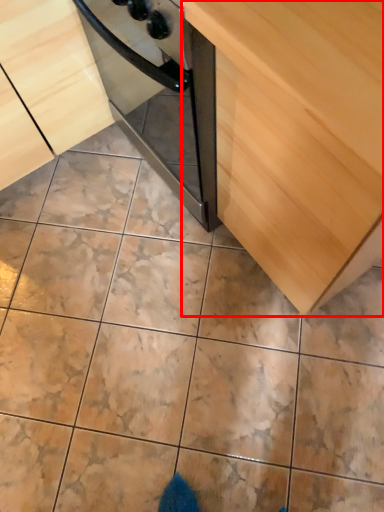
Question: Observing the image, what is the correct spatial positioning of cabinetry (annotated by the red box) in reference to cabinetry?

Choices:
 (A) right
 (B) left

Answer: (A)